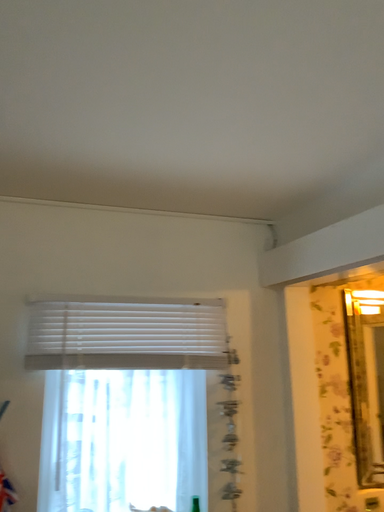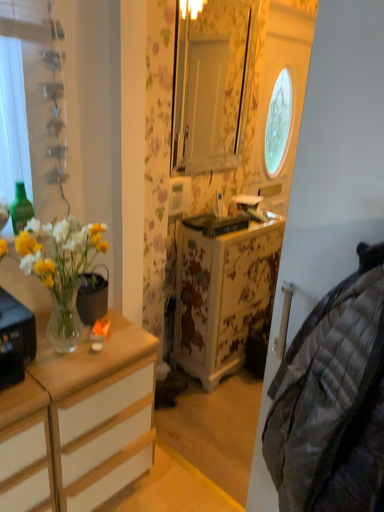
Question: Which way did the camera rotate in the video?

Choices:
 (A) rotated downward
 (B) rotated upward

Answer: (A)